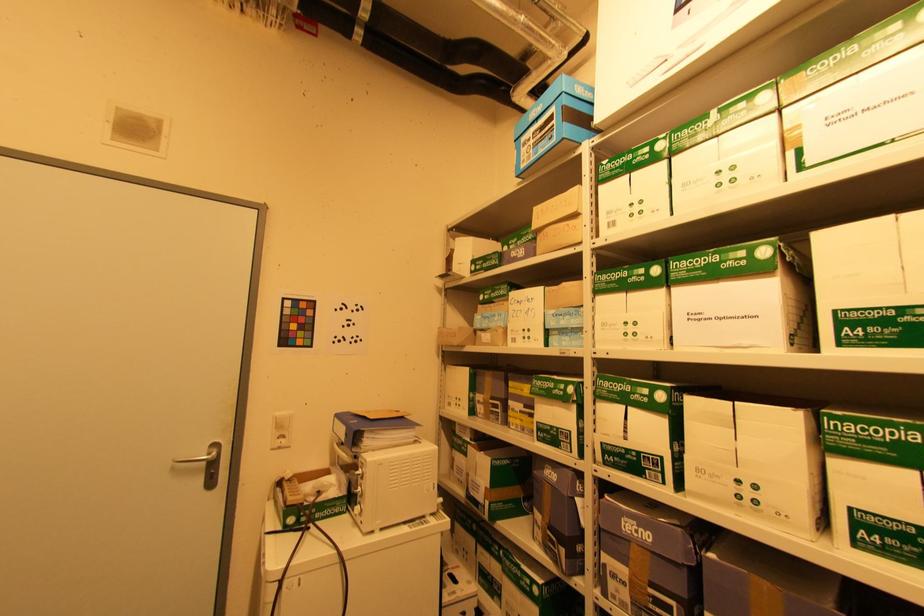
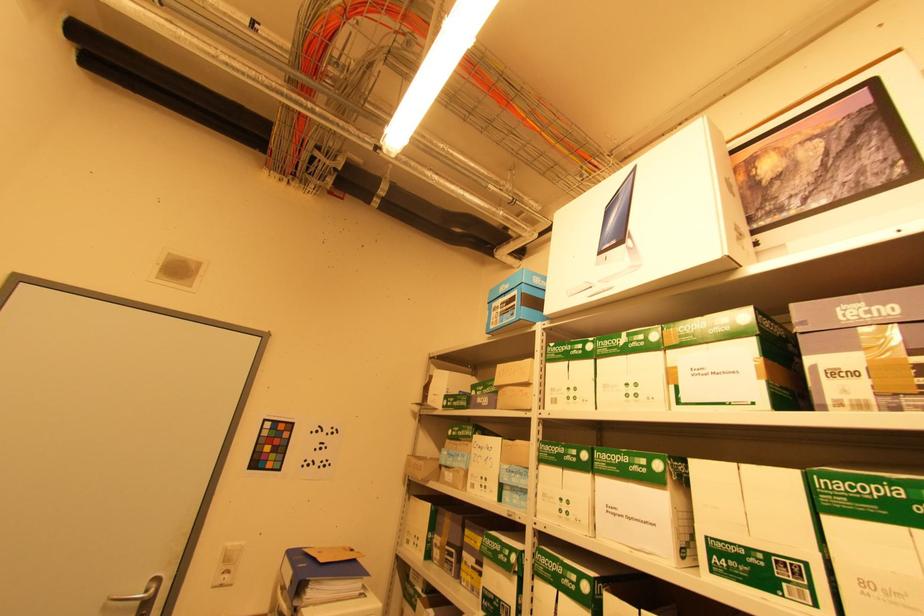
In the scene shown: The images are taken continuously from a first-person perspective. In which direction are you moving?

The cameraman walked toward right, backward.